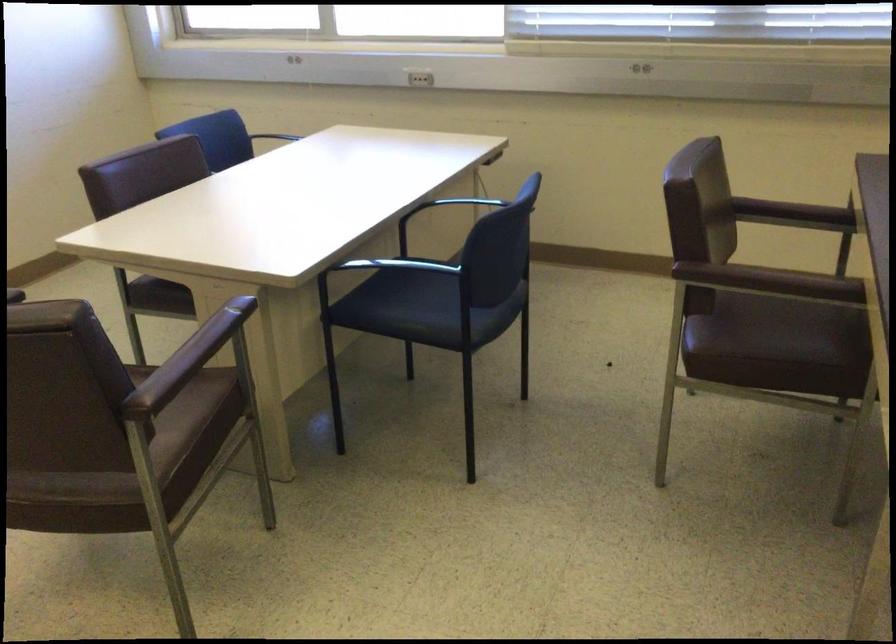
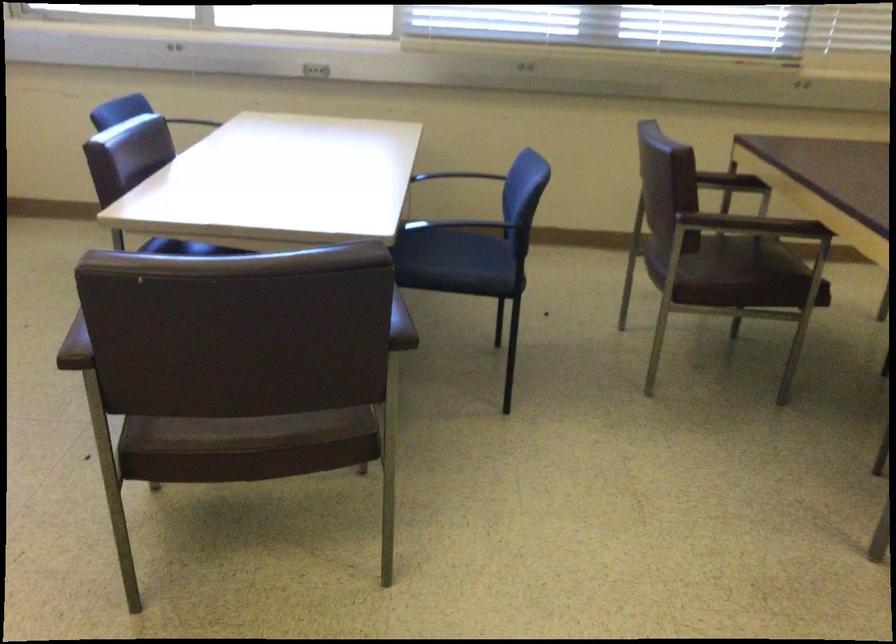
Find the pixel in the second image that matches (x=570, y=245) in the first image.

(466, 230)